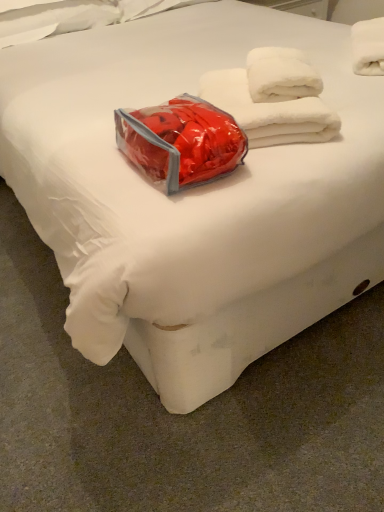
Question: From the image's perspective, is shiny plastic bag at center positioned above or below white fluffy towel at upper right, the first towel from the right?

Choices:
 (A) below
 (B) above

Answer: (A)

Question: From a real-world perspective, relative to white fluffy towel at upper right, the first towel from the right, is shiny plastic bag at center vertically above or below?

Choices:
 (A) above
 (B) below

Answer: (B)

Question: Based on their relative distances, which object is farther from the white fluffy towels at upper right, which is the 2th towel from right to left?

Choices:
 (A) white fluffy towel at upper right, arranged as the 2th towel when viewed from the left
 (B) shiny plastic bag at center

Answer: (A)

Question: Considering the real-world distances, which object is farthest from the shiny plastic bag at center?

Choices:
 (A) white fluffy towel at upper right, positioned as the first towel in top-to-bottom order
 (B) white fluffy towels at upper right, which is counted as the 1th towel, starting from the bottom

Answer: (A)